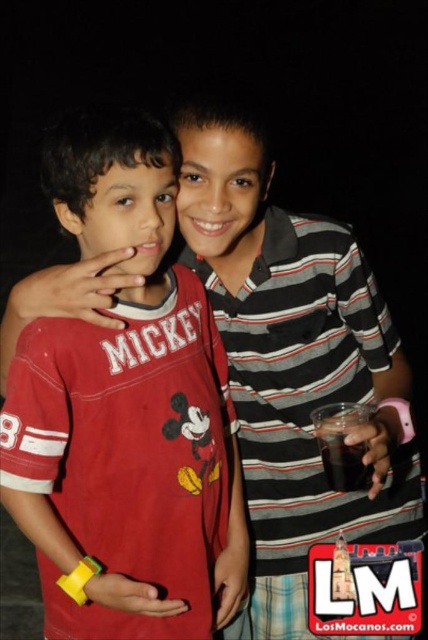
You are a photographer standing at a distance of 1 meter from the two boys in the image. You want to take a closeup shot of the point at coordinates point (76, 620). Can you capture this point clearly without moving closer than your current position?

The distance of point (76, 620) from camera is 1.17 meters, so you are currently 1 meter away from the boys. Since the point is 1.17 meters away from the camera, you need to move 0.17 meters closer to capture it clearly without zooming.

You are a photographer trying to capture a candid shot of the two boys. You want to ensure that both the red cotton shirt at center and the dark brown liquid at right are in focus. Given that your camera has a depth of field that can cover 15 inches, will you need to adjust your settings to include both in focus?

The red cotton shirt at center is 16.05 inches from the dark brown liquid at right. Since the distance between them exceeds the camera sensor depth of field of 15 inches, you will need to adjust your settings to ensure both are in focus.

You are taking a photo of two boys standing in front of you. You notice two points marked in the image, one at coordinates point (44, 157) and the other at point (318, 416). Which point is closer to your camera?

Point (44, 157) is closer to the camera than point (318, 416).